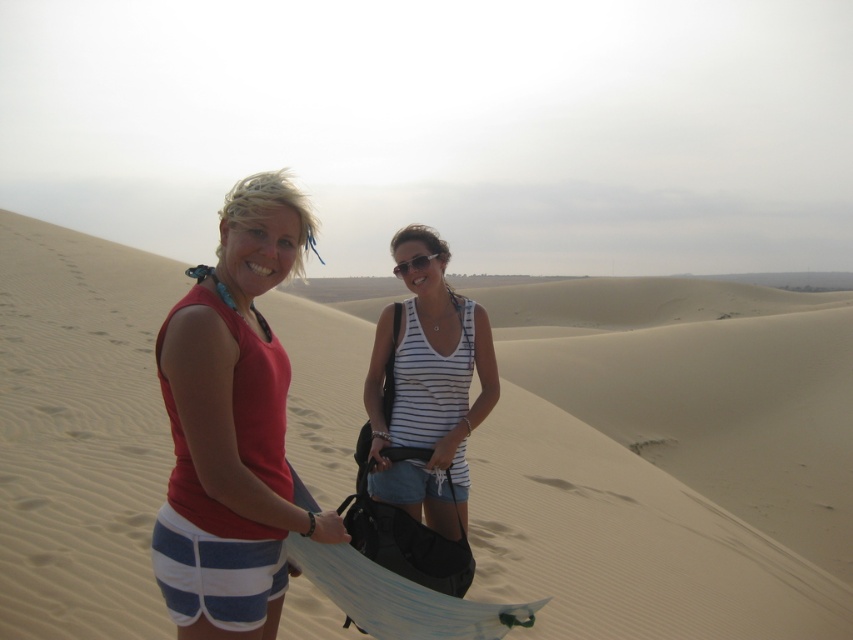
Does matte red tank top at left appear over white striped tank top at center?

Yes, matte red tank top at left is above white striped tank top at center.

Measure the distance between matte red tank top at left and white striped tank top at center.

matte red tank top at left is 3.69 feet away from white striped tank top at center.

Who is more forward, (280, 481) or (397, 380)?

Point (280, 481) is in front.

You are a GUI agent. You are given a task and a screenshot of the screen. Output one action in this format:
    pyautogui.click(x=<x>, y=<y>)
    Task: Click on the matte red tank top at left
    This screenshot has width=853, height=640.
    Given the screenshot: What is the action you would take?
    pyautogui.click(x=231, y=426)

Consider the image. Is matte red tank top at left to the left of black plastic sunglasses at center from the viewer's perspective?

Correct, you'll find matte red tank top at left to the left of black plastic sunglasses at center.

Who is more forward, (210, 269) or (425, 266)?

Point (210, 269)

I want to click on matte red tank top at left, so click(x=231, y=426).

Is point (140, 403) positioned behind point (404, 266)?

Yes, point (140, 403) is farther from viewer.

Which is behind, point (112, 506) or point (397, 273)?

The point (112, 506) is behind.

Does point (26, 525) lie behind point (415, 268)?

Yes.

This screenshot has height=640, width=853. I want to click on beige sandy dunes at center, so click(79, 433).